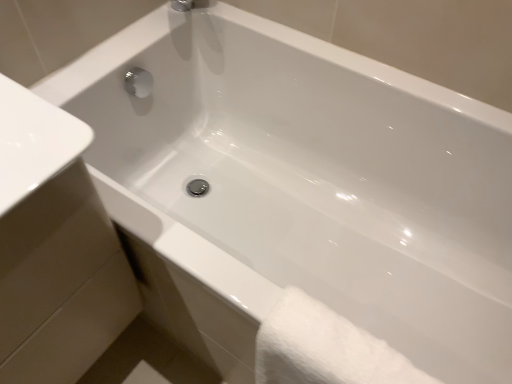
The image size is (512, 384). Identify the location of white fluffy towel at lower right. (324, 348).

The image size is (512, 384). Describe the element at coordinates (324, 348) in the screenshot. I see `white fluffy towel at lower right` at that location.

Identify the location of white glossy sink at lower left. The height and width of the screenshot is (384, 512). (54, 248).

What do you see at coordinates (54, 248) in the screenshot?
I see `white glossy sink at lower left` at bounding box center [54, 248].

Locate an element on the screen. Image resolution: width=512 pixels, height=384 pixels. white fluffy towel at lower right is located at coordinates (324, 348).

Is white glossy sink at lower left at the right side of white fluffy towel at lower right?

Incorrect, white glossy sink at lower left is not on the right side of white fluffy towel at lower right.

Consider the image. Considering their positions, is white glossy sink at lower left located in front of or behind white fluffy towel at lower right?

In the image, white glossy sink at lower left appears in front of white fluffy towel at lower right.

Which point is more distant from viewer, (17, 382) or (362, 353)?

Positioned behind is point (17, 382).

Looking at this image, from the image's perspective, is white glossy sink at lower left located above white fluffy towel at lower right?

Yes.

From a real-world perspective, who is located higher, white glossy sink at lower left or white fluffy towel at lower right?

white glossy sink at lower left, from a real-world perspective.

Based on the photo, looking at their sizes, would you say white glossy sink at lower left is wider or thinner than white fluffy towel at lower right?

In the image, white glossy sink at lower left appears to be wider than white fluffy towel at lower right.

In terms of height, does white glossy sink at lower left look taller or shorter compared to white fluffy towel at lower right?

white glossy sink at lower left is taller than white fluffy towel at lower right.

Considering the sizes of white glossy sink at lower left and white fluffy towel at lower right in the image, is white glossy sink at lower left bigger or smaller than white fluffy towel at lower right?

white glossy sink at lower left is bigger than white fluffy towel at lower right.

Looking at this image, is white glossy sink at lower left inside the boundaries of white fluffy towel at lower right, or outside?

white glossy sink at lower left cannot be found inside white fluffy towel at lower right.

Is the surface of white glossy sink at lower left in direct contact with white fluffy towel at lower right?

No, white glossy sink at lower left is not with white fluffy towel at lower right.

Is white glossy sink at lower left turned away from white fluffy towel at lower right?

No, white fluffy towel at lower right is not at the back of white glossy sink at lower left.

How far apart are white glossy sink at lower left and white fluffy towel at lower right?

The distance of white glossy sink at lower left from white fluffy towel at lower right is 14.02 inches.

This screenshot has width=512, height=384. Identify the location of bath towel below the white glossy sink at lower left (from the image's perspective). (324, 348).

Based on their positions, is white fluffy towel at lower right located to the left or right of white glossy sink at lower left?

Result: In the image, white fluffy towel at lower right appears on the right side of white glossy sink at lower left.

Does white fluffy towel at lower right lie in front of white glossy sink at lower left?

No, white fluffy towel at lower right is further to the viewer.

Considering the points (296, 342) and (48, 128), which point is behind, point (296, 342) or point (48, 128)?

Positioned behind is point (296, 342).

From the image's perspective, who appears lower, white fluffy towel at lower right or white glossy sink at lower left?

white fluffy towel at lower right appears lower in the image.

From a real-world perspective, which is physically above, white fluffy towel at lower right or white glossy sink at lower left?

white glossy sink at lower left, from a real-world perspective.

Considering the sizes of objects white fluffy towel at lower right and white glossy sink at lower left in the image provided, who is thinner, white fluffy towel at lower right or white glossy sink at lower left?

white fluffy towel at lower right is thinner.

In terms of height, does white fluffy towel at lower right look taller or shorter compared to white glossy sink at lower left?

Clearly, white fluffy towel at lower right is shorter compared to white glossy sink at lower left.

Is white fluffy towel at lower right bigger or smaller than white glossy sink at lower left?

white fluffy towel at lower right is smaller than white glossy sink at lower left.

Is white fluffy towel at lower right located outside white glossy sink at lower left?

Yes, white fluffy towel at lower right is not within white glossy sink at lower left.

Is white fluffy towel at lower right positioned far away from white glossy sink at lower left?

No, there isn't a large distance between white fluffy towel at lower right and white glossy sink at lower left.

Looking at this image, could you tell me if white fluffy towel at lower right is facing white glossy sink at lower left?

No, white fluffy towel at lower right is not aimed at white glossy sink at lower left.

How many degrees apart are the facing directions of white fluffy towel at lower right and white glossy sink at lower left?

white fluffy towel at lower right and white glossy sink at lower left are facing 88.2 degrees away from each other.

This screenshot has width=512, height=384. I want to click on bath towel below the white glossy sink at lower left (from a real-world perspective), so click(324, 348).

Find the location of a particular element. The height and width of the screenshot is (384, 512). bath towel below the white glossy sink at lower left (from a real-world perspective) is located at coordinates (324, 348).

The image size is (512, 384). Identify the location of sink located above the white fluffy towel at lower right (from the image's perspective). (54, 248).